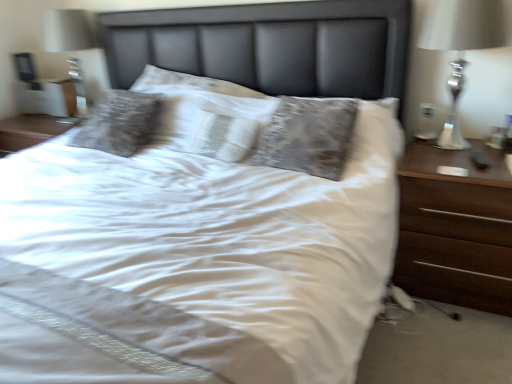
You are a GUI agent. You are given a task and a screenshot of the screen. Output one action in this format:
    pyautogui.click(x=<x>, y=<y>)
    Task: Click on the vacant region in front of silver metallic lamp at right
    
    Given the screenshot: What is the action you would take?
    tap(468, 169)